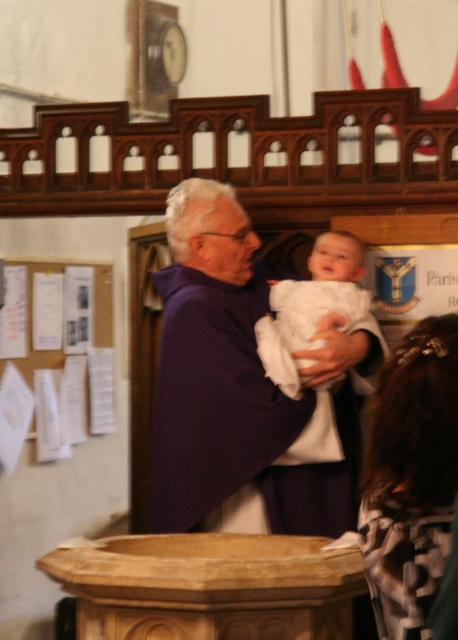
Question: Which point appears farthest from the camera in this image?

Choices:
 (A) (152, 512)
 (B) (305, 449)

Answer: (A)

Question: Observing the image, what is the correct spatial positioning of purple clothed man at center in reference to white clothed baby at center?

Choices:
 (A) below
 (B) above

Answer: (B)

Question: Which point is closer to the camera?

Choices:
 (A) white clothed baby at center
 (B) purple clothed man at center

Answer: (B)

Question: Can you confirm if purple clothed man at center is positioned to the left of white clothed baby at center?

Choices:
 (A) no
 (B) yes

Answer: (B)

Question: Observing the image, what is the correct spatial positioning of purple clothed man at center in reference to white clothed baby at center?

Choices:
 (A) right
 (B) left

Answer: (B)

Question: Which point appears closest to the camera in this image?

Choices:
 (A) (345, 312)
 (B) (190, 468)

Answer: (B)